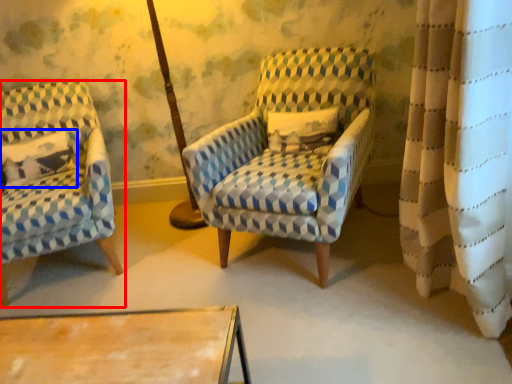
Question: Among these objects, which one is farthest to the camera, chair (highlighted by a red box) or pillow (highlighted by a blue box)?

Choices:
 (A) chair
 (B) pillow

Answer: (B)